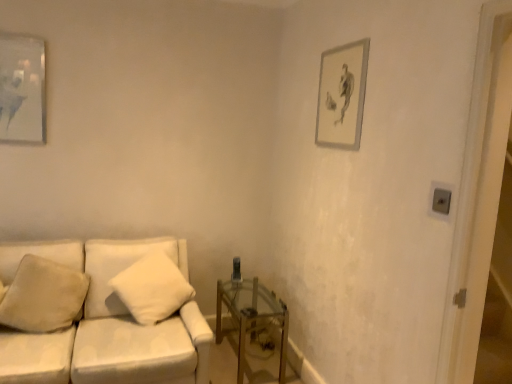
Question: Is beige soft pillow at lower left, marked as the 1th pillow in a left-to-right arrangement, in front of or behind white soft pillow at center, acting as the first pillow starting from the right, in the image?

Choices:
 (A) behind
 (B) front

Answer: (B)

Question: Looking at their shapes, would you say beige soft pillow at lower left, which ranks as the 2th pillow in right-to-left order, is wider or thinner than white soft pillow at center, acting as the first pillow starting from the right?

Choices:
 (A) thin
 (B) wide

Answer: (A)

Question: Based on their relative distances, which object is nearer to the matte gray picture frame at upper right, which ranks as the second picture frame in left-to-right order?

Choices:
 (A) beige soft pillow at lower left, marked as the 1th pillow in a left-to-right arrangement
 (B) white fabric couch at center
 (C) transparent glass table at lower right
 (D) matte glass picture frame at upper left, which is counted as the 2th picture frame, starting from the right
 (E) white soft pillow at center, arranged as the 2th pillow when viewed from the left

Answer: (E)

Question: Based on their relative distances, which object is farther from the white fabric couch at center?

Choices:
 (A) transparent glass table at lower right
 (B) white soft pillow at center, acting as the first pillow starting from the right
 (C) matte gray picture frame at upper right, the first picture frame viewed from the right
 (D) matte glass picture frame at upper left, the 1th picture frame in the left-to-right sequence
 (E) beige soft pillow at lower left, which ranks as the 2th pillow in right-to-left order

Answer: (C)